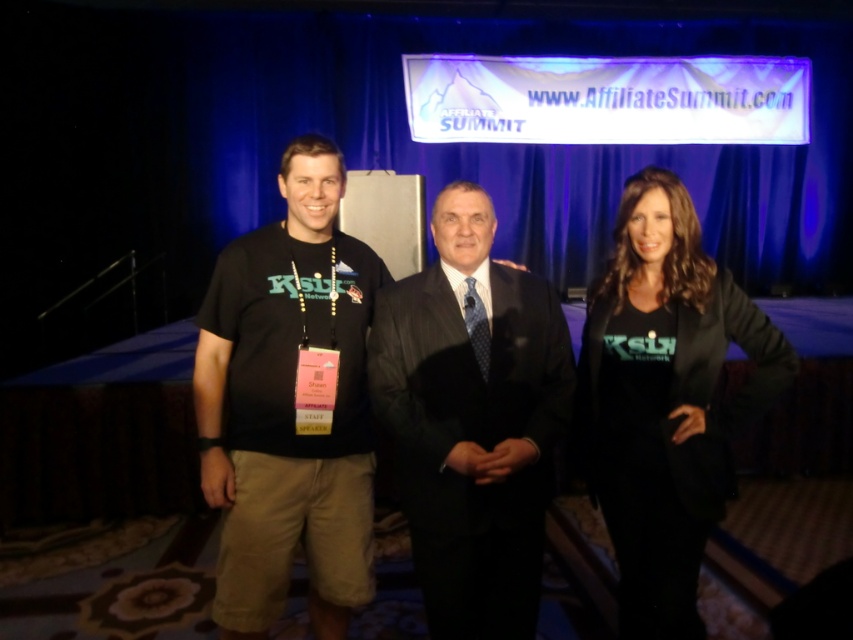
You are standing in front of the stage at the Affiliate Summit event. You notice two points marked in the image. The first point is at coordinates point (343, 438) and the second point is at point (538, 394). Which point is closer to you?

Point (343, 438) is closer to you because it is further to the camera than point (538, 394).